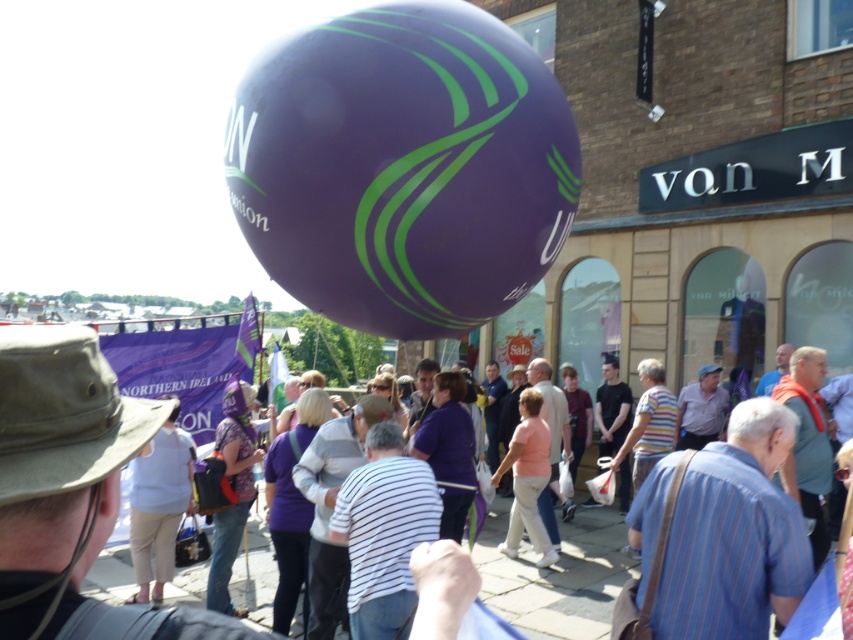
You are a photographer trying to capture a photo of the light blue cotton shirt at center without the purple fabric crowd at center blocking it. Is this possible based on their positions?

The purple fabric crowd at center is positioned under the light blue cotton shirt at center, so the shirt is above the crowd. Therefore, the photographer can capture the light blue cotton shirt at center without obstruction from the purple fabric crowd at center.

You are a photographer trying to capture a photo of the purple glossy balloon at center and the light blue cotton shirt at center from the same angle. Which object will appear wider in the photo?

The purple glossy balloon at center will appear wider in the photo because its width is larger than that of the light blue cotton shirt at center.

You are a photographer trying to capture a photo of the light blue cotton shirt at center without the purple fabric crowd at center blocking it. Is this possible given their relative sizes?

The purple fabric crowd at center is wider than the light blue cotton shirt at center, so it might block the view unless you move to a position where the shirt is outside the crowd area.